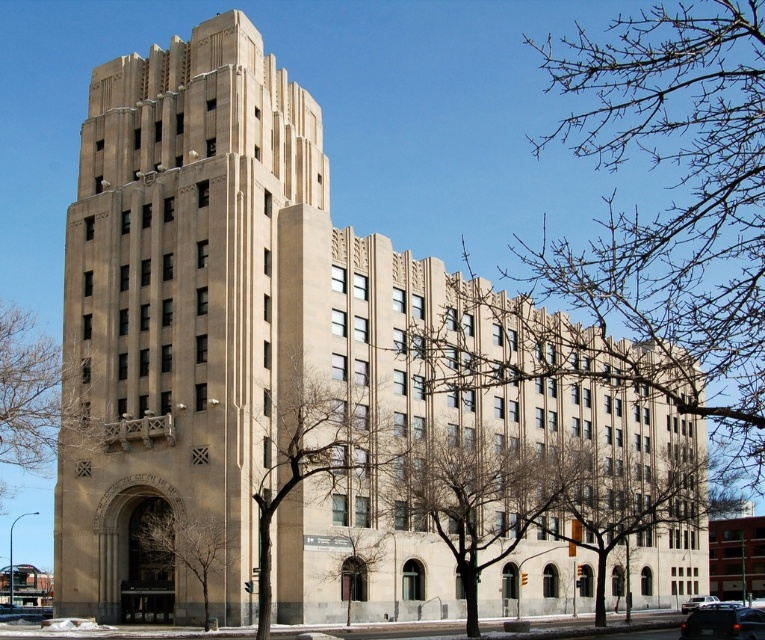
Describe the element at coordinates (176, 312) in the screenshot. I see `beige stone tower at center` at that location.

Can you confirm if beige stone tower at center is wider than black rubber car at lower right?

Yes, beige stone tower at center is wider than black rubber car at lower right.

Is point (220, 102) closer to viewer compared to point (682, 628)?

That is False.

Find the location of a particular element. The image size is (765, 640). beige stone tower at center is located at coordinates (176, 312).

Is point (710, 636) behind point (685, 612)?

No, it is in front of (685, 612).

Which is below, black rubber car at lower right or metallic silver sedan at center?

Positioned lower is metallic silver sedan at center.

Image resolution: width=765 pixels, height=640 pixels. Identify the location of black rubber car at lower right. (723, 624).

Measure the distance between point (x=239, y=346) and camera.

A distance of 62.96 meters exists between point (x=239, y=346) and camera.

Does beige stone tower at center appear over metallic silver sedan at center?

Indeed, beige stone tower at center is positioned over metallic silver sedan at center.

Is point (230, 490) behind point (700, 604)?

That is False.

Identify the location of beige stone tower at center. The image size is (765, 640). (176, 312).